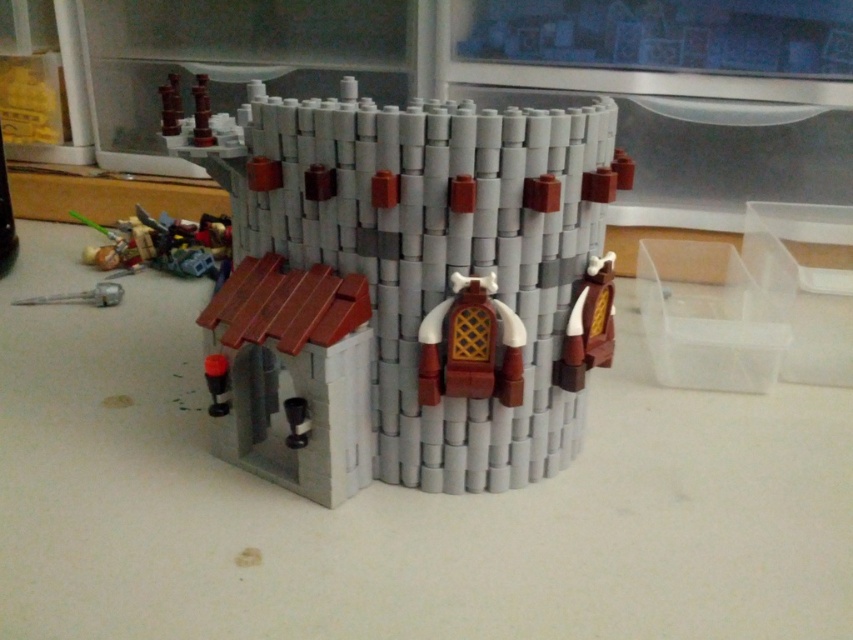
Consider the image. Who is shorter, smooth gray castle at center or matte black cylinder at lower left?

matte black cylinder at lower left

In order to click on smooth gray castle at center in this screenshot , I will do `click(424, 280)`.

This screenshot has height=640, width=853. Find the location of `smooth gray castle at center`. smooth gray castle at center is located at coordinates (424, 280).

Who is shorter, shiny plastic sword at lower left or matte black cylinder at lower left?

matte black cylinder at lower left is shorter.

Describe the element at coordinates (164, 244) in the screenshot. This screenshot has width=853, height=640. I see `shiny plastic sword at lower left` at that location.

Does point (107, 228) come closer to viewer compared to point (216, 392)?

No, it is not.

Find the location of a particular element. This screenshot has width=853, height=640. shiny plastic sword at lower left is located at coordinates (164, 244).

Is the position of brown matte armor at center less distant than that of matte black cylinder at lower left?

That is True.

In the scene shown: Does brown matte armor at center have a smaller size compared to matte black cylinder at lower left?

Indeed, brown matte armor at center has a smaller size compared to matte black cylinder at lower left.

Locate an element on the screen. The width and height of the screenshot is (853, 640). brown matte armor at center is located at coordinates (471, 346).

Where is `brown matte armor at center`? This screenshot has height=640, width=853. brown matte armor at center is located at coordinates (471, 346).